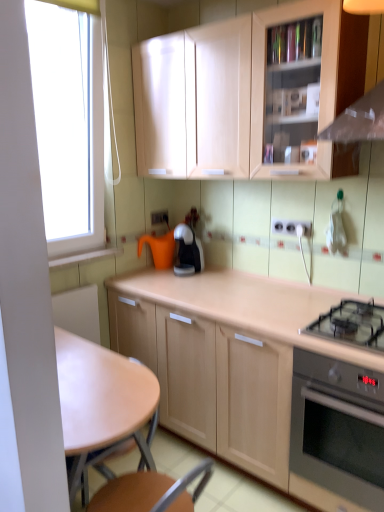
Question: From a real-world perspective, is light brown wooden table at center above or below matte wood cabinet at upper center, placed as the 1th cabinetry when sorted from top to bottom?

Choices:
 (A) below
 (B) above

Answer: (A)

Question: From the image's perspective, is light brown wooden table at center above or below matte wood cabinet at upper center, placed as the 2th cabinetry when sorted from bottom to top?

Choices:
 (A) above
 (B) below

Answer: (B)

Question: Estimate the real-world distances between objects in this image. Which object is closer to the black glass gas stove at lower right?

Choices:
 (A) stainless steel oven at lower right
 (B) light brown wooden table at center
 (C) white plastic electrical outlet at center, which appears as the 1th electric outlet when viewed from the right
 (D) light wood cabinet at center, acting as the 1th cabinetry starting from the bottom
 (E) matte wood cabinet at upper center, placed as the 2th cabinetry when sorted from bottom to top

Answer: (A)

Question: Which object is positioned farthest from the stainless steel oven at lower right?

Choices:
 (A) black glossy coffee maker at center
 (B) matte wood cabinet at upper center, placed as the 1th cabinetry when sorted from top to bottom
 (C) orange matte watering can at center
 (D) white plastic electric outlet at center, the 2th electric outlet in the bottom-to-top sequence
 (E) black glass gas stove at lower right

Answer: (D)